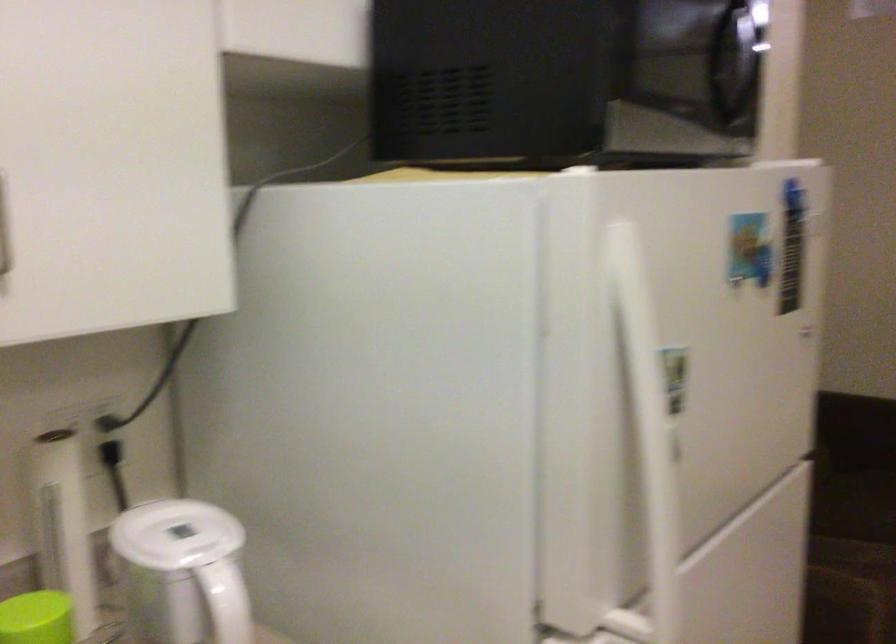
Find the location of a particular element. white kettle handle is located at coordinates (226, 601).